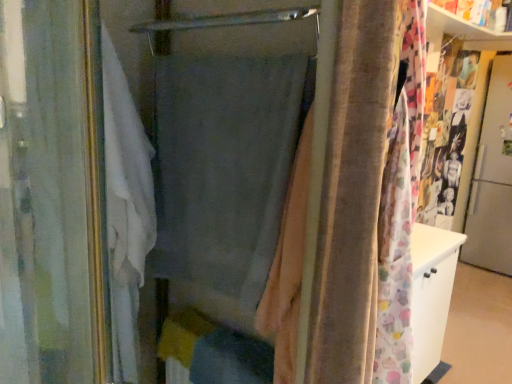
Question: Is white fabric curtain at left, the 1th curtain from the left, further to camera compared to gray fabric curtain at center, the 1th curtain positioned from the right?

Choices:
 (A) no
 (B) yes

Answer: (A)

Question: Does white fabric curtain at left, which appears as the 2th curtain when viewed from the right, have a smaller size compared to gray fabric curtain at center, which appears as the 2th curtain when viewed from the left?

Choices:
 (A) no
 (B) yes

Answer: (A)

Question: Considering the relative sizes of white fabric curtain at left, the 1th curtain from the left, and gray fabric curtain at center, the 1th curtain positioned from the right, in the image provided, is white fabric curtain at left, the 1th curtain from the left, thinner than gray fabric curtain at center, the 1th curtain positioned from the right,?

Choices:
 (A) yes
 (B) no

Answer: (B)

Question: From the image's perspective, is white fabric curtain at left, which appears as the 2th curtain when viewed from the right, beneath gray fabric curtain at center, the 1th curtain positioned from the right?

Choices:
 (A) no
 (B) yes

Answer: (B)

Question: Is white fabric curtain at left, the 1th curtain from the left, not within gray fabric curtain at center, the 1th curtain positioned from the right?

Choices:
 (A) no
 (B) yes

Answer: (B)

Question: Is white fabric curtain at left, the 1th curtain from the left, bigger than gray fabric curtain at center, which appears as the 2th curtain when viewed from the left?

Choices:
 (A) no
 (B) yes

Answer: (B)

Question: Does gray fabric curtain at center, the 1th curtain positioned from the right, have a greater width compared to white fabric curtain at left, which appears as the 2th curtain when viewed from the right?

Choices:
 (A) yes
 (B) no

Answer: (B)

Question: From a real-world perspective, is gray fabric curtain at center, which appears as the 2th curtain when viewed from the left, positioned under white fabric curtain at left, the 1th curtain from the left, based on gravity?

Choices:
 (A) yes
 (B) no

Answer: (B)

Question: Would you consider gray fabric curtain at center, the 1th curtain positioned from the right, to be distant from white fabric curtain at left, which appears as the 2th curtain when viewed from the right?

Choices:
 (A) no
 (B) yes

Answer: (A)

Question: Is gray fabric curtain at center, which appears as the 2th curtain when viewed from the left, facing towards white fabric curtain at left, which appears as the 2th curtain when viewed from the right?

Choices:
 (A) no
 (B) yes

Answer: (B)

Question: Is gray fabric curtain at center, which appears as the 2th curtain when viewed from the left, directly adjacent to white fabric curtain at left, which appears as the 2th curtain when viewed from the right?

Choices:
 (A) yes
 (B) no

Answer: (B)

Question: Is gray fabric curtain at center, which appears as the 2th curtain when viewed from the left, behind white fabric curtain at left, the 1th curtain from the left?

Choices:
 (A) no
 (B) yes

Answer: (B)

Question: Considering the relative sizes of metallic silver screen door at right and gray fabric curtain at center, the 1th curtain positioned from the right, in the image provided, is metallic silver screen door at right thinner than gray fabric curtain at center, the 1th curtain positioned from the right,?

Choices:
 (A) yes
 (B) no

Answer: (B)